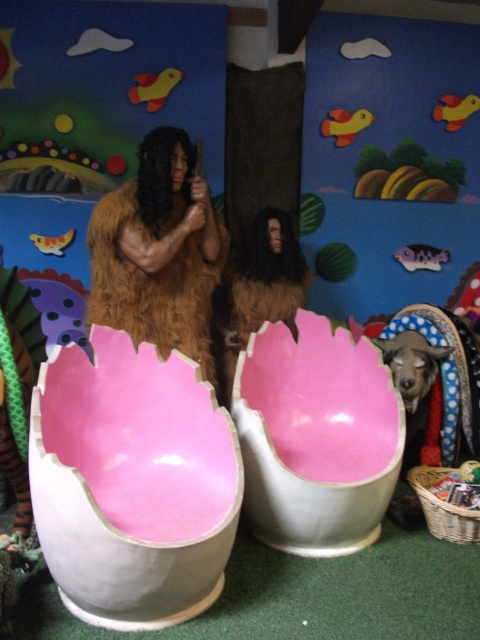
Question: Does brown furry costume at center appear on the right side of shiny black dog at lower right?

Choices:
 (A) yes
 (B) no

Answer: (B)

Question: Which point is closer to the camera taking this photo?

Choices:
 (A) (396, 340)
 (B) (204, 182)

Answer: (B)

Question: Does brown furry costume at center appear on the left side of shiny black dog at lower right?

Choices:
 (A) yes
 (B) no

Answer: (A)

Question: Which point is farther from the camera taking this photo?

Choices:
 (A) (155, 305)
 (B) (398, 378)

Answer: (B)

Question: Which point appears closest to the camera in this image?

Choices:
 (A) (190, 340)
 (B) (396, 378)

Answer: (A)

Question: In this image, where is brown furry costume at center located relative to shiny black dog at lower right?

Choices:
 (A) below
 (B) above

Answer: (B)